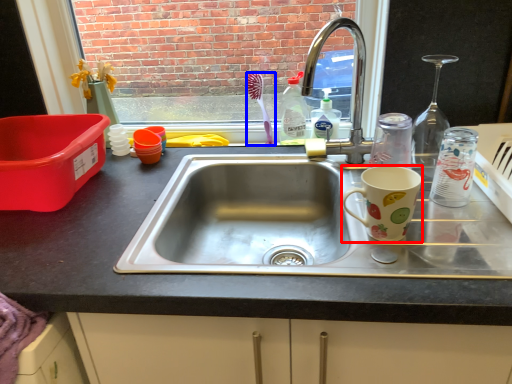
Question: Which of the following is the farthest to the observer, coffee cup (highlighted by a red box) or toothbrush (highlighted by a blue box)?

Choices:
 (A) coffee cup
 (B) toothbrush

Answer: (B)